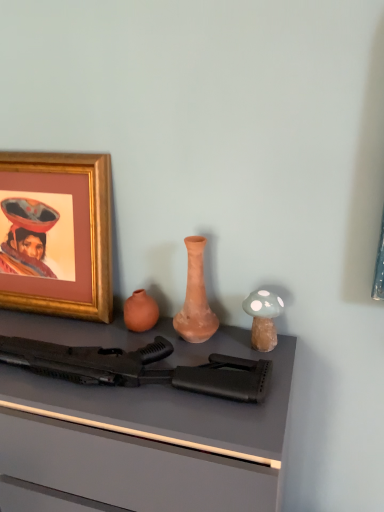
Locate an element on the screen. Image resolution: width=384 pixels, height=512 pixels. matte clay vase at center is located at coordinates (195, 298).

Measure the distance between matte black rifle at center and camera.

76.71 centimeters.

The image size is (384, 512). What do you see at coordinates (139, 428) in the screenshot?
I see `matte black rifle at center` at bounding box center [139, 428].

Describe the element at coordinates (140, 368) in the screenshot. I see `black matte rifle at center` at that location.

At what (x,y) coordinates should I click in order to perform the action: click on matte clay vase at center. Please return your answer as a coordinate pair (x, y). Looking at the image, I should click on (195, 298).

Is point (193, 248) closer or farther from the camera than point (208, 501)?

Point (193, 248) appears to be farther away from the viewer than point (208, 501).

Between matte clay vase at center and matte black rifle at center, which one is positioned in front?

matte black rifle at center.

Is matte clay vase at center next to matte black rifle at center and touching it?

No, matte clay vase at center is not with matte black rifle at center.

From the image's perspective, is matte clay vase at center under matte black rifle at center?

Actually, matte clay vase at center appears above matte black rifle at center in the image.

How far apart are black matte rifle at center and matte black rifle at center?

black matte rifle at center and matte black rifle at center are 4.56 inches apart from each other.

Can you tell me how much black matte rifle at center and matte black rifle at center differ in facing direction?

The facing directions of black matte rifle at center and matte black rifle at center are 1.38 degrees apart.

Who is smaller, black matte rifle at center or matte black rifle at center?

black matte rifle at center is smaller.

Is black matte rifle at center thinner than matte black rifle at center?

Correct, the width of black matte rifle at center is less than that of matte black rifle at center.

From the image's perspective, between gold-framed picture at upper left and black matte rifle at center, which one is located above?

From the image's view, gold-framed picture at upper left is above.

From a real-world perspective, is gold-framed picture at upper left on top of black matte rifle at center?

Correct, in the physical world, gold-framed picture at upper left is higher than black matte rifle at center.

Does point (66, 295) appear closer or farther from the camera than point (106, 372)?

Point (66, 295) is farther from the camera than point (106, 372).

Is gold-framed picture at upper left oriented away from black matte rifle at center?

That's not correct — gold-framed picture at upper left is not looking away from black matte rifle at center.

Is black matte rifle at center surrounded by matte black rifle at center?

No.

Based on the photo, what's the angular difference between matte black rifle at center and black matte rifle at center's facing directions?

1.38 degrees.

Does matte black rifle at center turn towards black matte rifle at center?

No, matte black rifle at center is not oriented towards black matte rifle at center.

Which object is positioned more to the left, matte black rifle at center or black matte rifle at center?

matte black rifle at center.

Between black matte rifle at center and matte clay vase at center, which one has more height?

matte clay vase at center is taller.

Is black matte rifle at center next to matte clay vase at center and touching it?

No, black matte rifle at center is not next to matte clay vase at center.

Is black matte rifle at center surrounding matte clay vase at center?

No, black matte rifle at center does not contain matte clay vase at center.

From the image's perspective, is black matte rifle at center located beneath matte clay vase at center?

Yes, from the image's perspective, black matte rifle at center is below matte clay vase at center.

From the image's perspective, between gold-framed picture at upper left and matte clay vase at center, who is located below?

From the image's view, matte clay vase at center is below.

Is gold-framed picture at upper left inside or outside of matte clay vase at center?

gold-framed picture at upper left is spatially situated outside matte clay vase at center.

Is point (110, 227) behind point (177, 327)?

Yes, point (110, 227) is behind point (177, 327).

Is gold-framed picture at upper left far from matte clay vase at center?

No, gold-framed picture at upper left is not far away from matte clay vase at center.

Is gold-framed picture at upper left located outside matte black rifle at center?

Indeed, gold-framed picture at upper left is completely outside matte black rifle at center.

Does gold-framed picture at upper left have a greater height compared to matte black rifle at center?

In fact, gold-framed picture at upper left may be shorter than matte black rifle at center.

Is gold-framed picture at upper left directly adjacent to matte black rifle at center?

gold-framed picture at upper left and matte black rifle at center are not in contact.

Find the location of `vase lying behind the matte black rifle at center`. vase lying behind the matte black rifle at center is located at coordinates (195, 298).

You are a GUI agent. You are given a task and a screenshot of the screen. Output one action in this format:
    pyautogui.click(x=<x>, y=<y>)
    Task: Click on the desk that appears in front of the black matte rifle at center
    The width and height of the screenshot is (384, 512).
    Given the screenshot: What is the action you would take?
    pyautogui.click(x=139, y=428)

Considering their positions, is black matte rifle at center positioned further to matte clay vase at center than matte black rifle at center?

Among the two, matte black rifle at center is located further to matte clay vase at center.

Which object lies nearer to the anchor point matte clay vase at center, gold-framed picture at upper left or matte black rifle at center?

matte black rifle at center is closer to matte clay vase at center.

Looking at the image, which one is located further to matte black rifle at center, gold-framed picture at upper left or matte clay vase at center?

Among the two, gold-framed picture at upper left is located further to matte black rifle at center.

From the image, which object appears to be nearer to matte black rifle at center, black matte rifle at center or matte clay vase at center?

black matte rifle at center is closer to matte black rifle at center.

From the image, which object appears to be farther from matte clay vase at center, matte black rifle at center or black matte rifle at center?

Among the two, matte black rifle at center is located further to matte clay vase at center.

Considering their positions, is matte black rifle at center positioned closer to black matte rifle at center than matte clay vase at center?

matte black rifle at center is positioned closer to the anchor black matte rifle at center.

Estimate the real-world distances between objects in this image. Which object is closer to matte clay vase at center, gold-framed picture at upper left or black matte rifle at center?

black matte rifle at center is closer to matte clay vase at center.

Estimate the real-world distances between objects in this image. Which object is further from black matte rifle at center, matte black rifle at center or gold-framed picture at upper left?

gold-framed picture at upper left.

Where is `rifle situated between gold-framed picture at upper left and matte clay vase at center from left to right`? rifle situated between gold-framed picture at upper left and matte clay vase at center from left to right is located at coordinates (140, 368).

This screenshot has height=512, width=384. In order to click on vase between gold-framed picture at upper left and matte black rifle at center vertically in this screenshot , I will do `click(195, 298)`.

This screenshot has height=512, width=384. Identify the location of rifle between gold-framed picture at upper left and matte black rifle at center vertically. (140, 368).

Image resolution: width=384 pixels, height=512 pixels. I want to click on rifle between matte clay vase at center and matte black rifle at center in the vertical direction, so click(x=140, y=368).